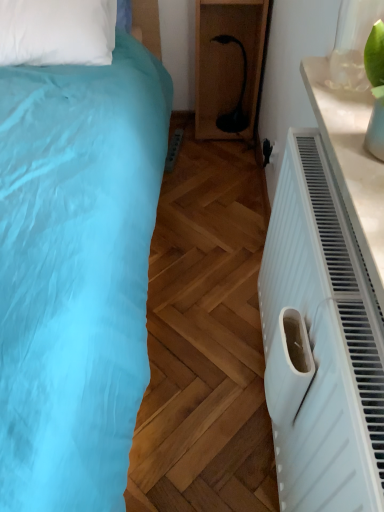
Question: Is black plastic lamp at center situated inside white plastic electric outlet at center-right or outside?

Choices:
 (A) inside
 (B) outside

Answer: (B)

Question: Looking at their shapes, would you say black plastic lamp at center is wider or thinner than white plastic electric outlet at center-right?

Choices:
 (A) thin
 (B) wide

Answer: (B)

Question: Is black plastic lamp at center to the left or to the right of white plastic electric outlet at center-right in the image?

Choices:
 (A) left
 (B) right

Answer: (A)

Question: Is point (266, 141) positioned closer to the camera than point (195, 125)?

Choices:
 (A) farther
 (B) closer

Answer: (B)

Question: Is white plastic electric outlet at center-right wider or thinner than black plastic lamp at center?

Choices:
 (A) thin
 (B) wide

Answer: (A)

Question: Is white plastic electric outlet at center-right bigger or smaller than black plastic lamp at center?

Choices:
 (A) big
 (B) small

Answer: (B)

Question: Considering the positions of white plastic electric outlet at center-right and black plastic lamp at center in the image, is white plastic electric outlet at center-right taller or shorter than black plastic lamp at center?

Choices:
 (A) short
 (B) tall

Answer: (A)